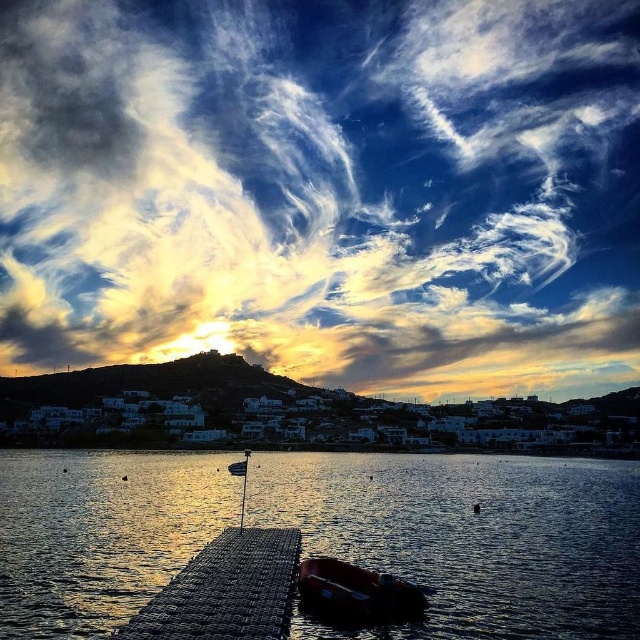
Between glistening water at dock center and rustic wooden dock at lower center, which one appears on the right side from the viewer's perspective?

Positioned to the right is glistening water at dock center.

Is the position of glistening water at dock center less distant than that of rustic wooden dock at lower center?

No, glistening water at dock center is further to the viewer.

In order to click on glistening water at dock center in this screenshot , I will do `click(468, 536)`.

Who is lower down, rustic wooden dock at lower center or metallic red boat at lower center?

rustic wooden dock at lower center

The height and width of the screenshot is (640, 640). Find the location of `rustic wooden dock at lower center`. rustic wooden dock at lower center is located at coordinates (225, 589).

Is point (205, 589) closer to camera compared to point (312, 577)?

Yes, point (205, 589) is closer to viewer.

Locate an element on the screen. This screenshot has height=640, width=640. rustic wooden dock at lower center is located at coordinates (225, 589).

This screenshot has width=640, height=640. What are the coordinates of `glistening water at dock center` in the screenshot? It's located at (468, 536).

Consider the image. Between glistening water at dock center and metallic red boat at lower center, which one is positioned lower?

glistening water at dock center

Which is in front, point (481, 608) or point (406, 608)?

Point (406, 608)

You are a GUI agent. You are given a task and a screenshot of the screen. Output one action in this format:
    pyautogui.click(x=<x>, y=<y>)
    Task: Click on the glistening water at dock center
    The image size is (640, 640).
    Given the screenshot: What is the action you would take?
    pyautogui.click(x=468, y=536)